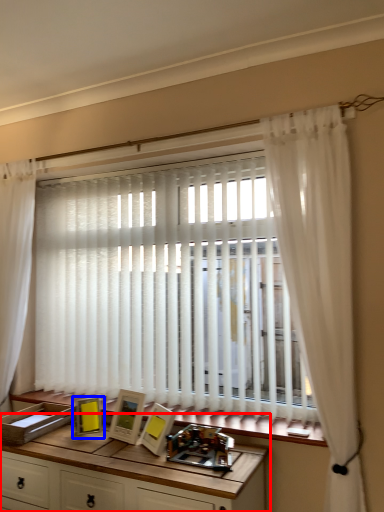
Question: Which object is closer to the camera taking this photo, table (highlighted by a red box) or picture frame (highlighted by a blue box)?

Choices:
 (A) table
 (B) picture frame

Answer: (A)